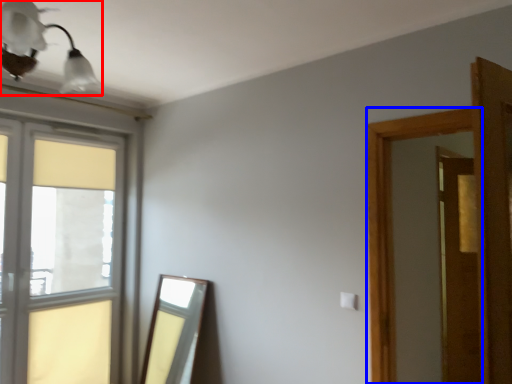
Question: Which of the following is the farthest to the observer, light fixture (highlighted by a red box) or window frame (highlighted by a blue box)?

Choices:
 (A) light fixture
 (B) window frame

Answer: (B)